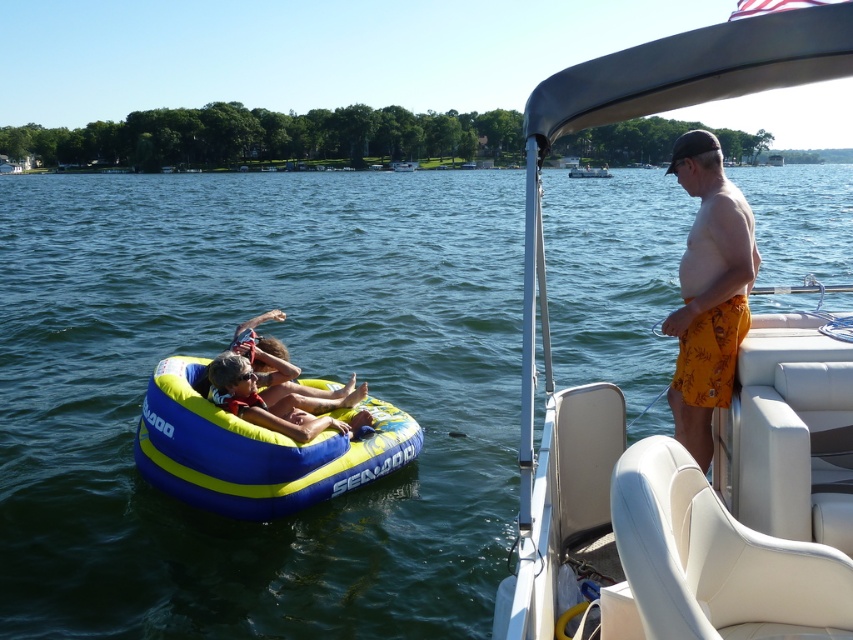
Is orange floral shorts at right above yellow fabric float at center?

Correct, orange floral shorts at right is located above yellow fabric float at center.

Which of these two, orange floral shorts at right or yellow fabric float at center, stands taller?

orange floral shorts at right is taller.

This screenshot has width=853, height=640. Identify the location of orange floral shorts at right. click(708, 291).

Where is `orange floral shorts at right`? This screenshot has height=640, width=853. orange floral shorts at right is located at coordinates 708,291.

This screenshot has height=640, width=853. Describe the element at coordinates (680, 500) in the screenshot. I see `white vinyl boat at center` at that location.

Who is more forward, [566,413] or [395,436]?

Positioned in front is point [566,413].

You are a GUI agent. You are given a task and a screenshot of the screen. Output one action in this format:
    pyautogui.click(x=<x>, y=<y>)
    Task: Click on the white vinyl boat at center
    The width and height of the screenshot is (853, 640).
    Given the screenshot: What is the action you would take?
    pyautogui.click(x=680, y=500)

Locate an element on the screen. white vinyl boat at center is located at coordinates (680, 500).

Looking at this image, who is lower down, blue inflatable tube at center or white plastic boat at upper center?

blue inflatable tube at center is lower down.

Does blue inflatable tube at center have a larger size compared to white plastic boat at upper center?

Yes, blue inflatable tube at center is bigger than white plastic boat at upper center.

Does point (120, 280) lie in front of point (601, 173)?

Yes, it is in front of point (601, 173).

Find the location of a particular element. The height and width of the screenshot is (640, 853). blue inflatable tube at center is located at coordinates (302, 376).